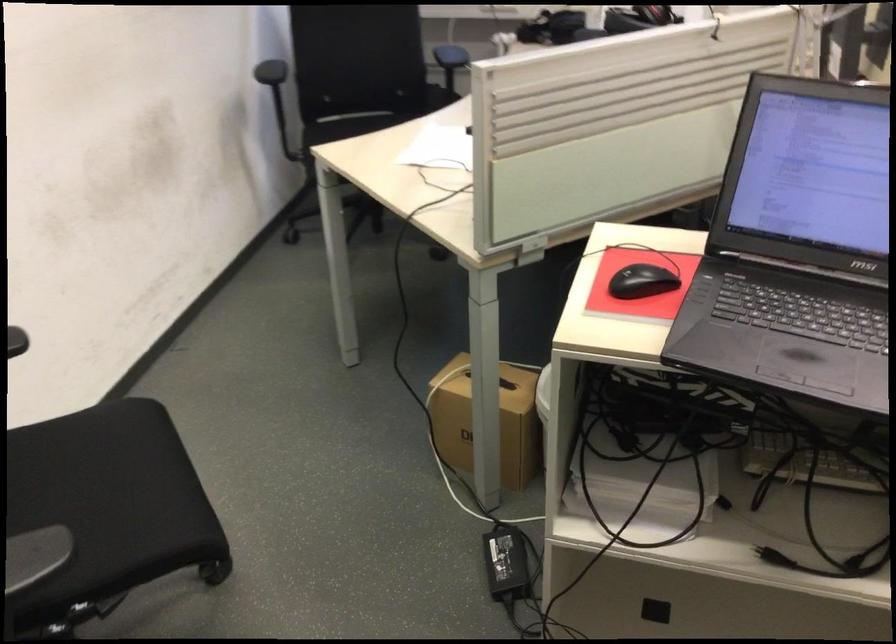
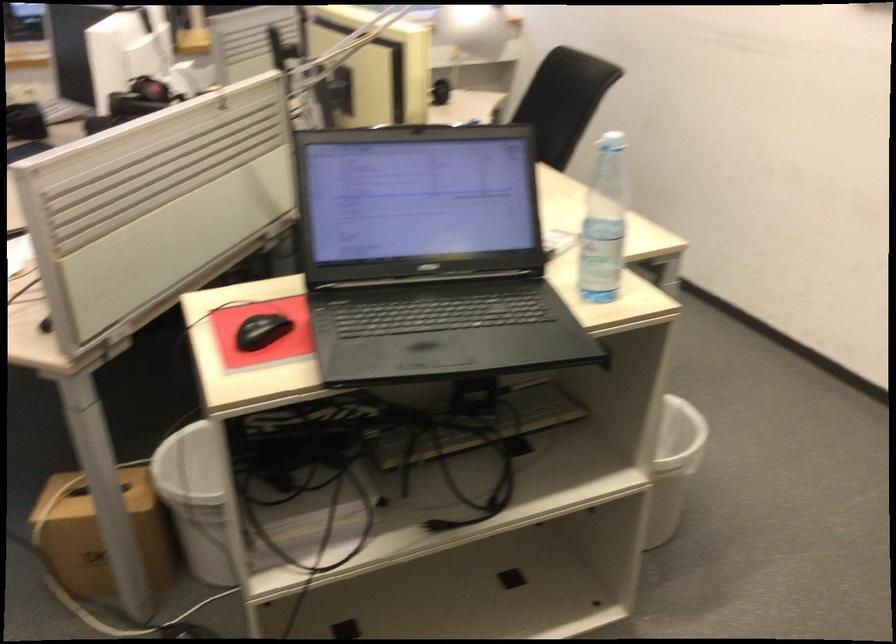
Locate, in the second image, the point that corresponds to (x=467, y=415) in the first image.

(100, 534)